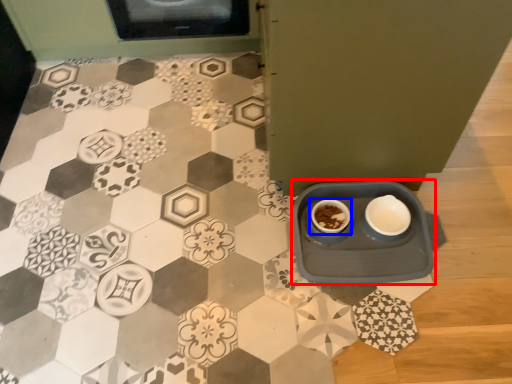
Question: Which object is further to the camera taking this photo, table (highlighted by a red box) or coffee cup (highlighted by a blue box)?

Choices:
 (A) table
 (B) coffee cup

Answer: (B)